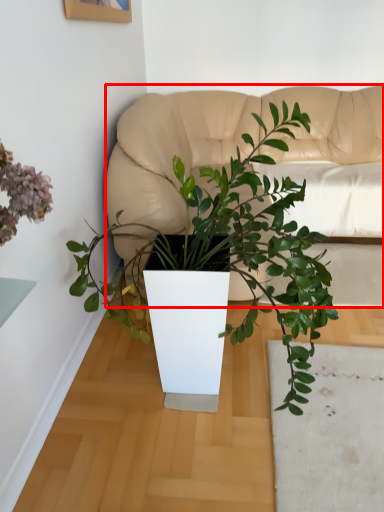
Question: From the image's perspective, considering the relative positions of couch (annotated by the red box) and houseplant in the image provided, where is couch (annotated by the red box) located with respect to the staircase?

Choices:
 (A) above
 (B) below

Answer: (A)